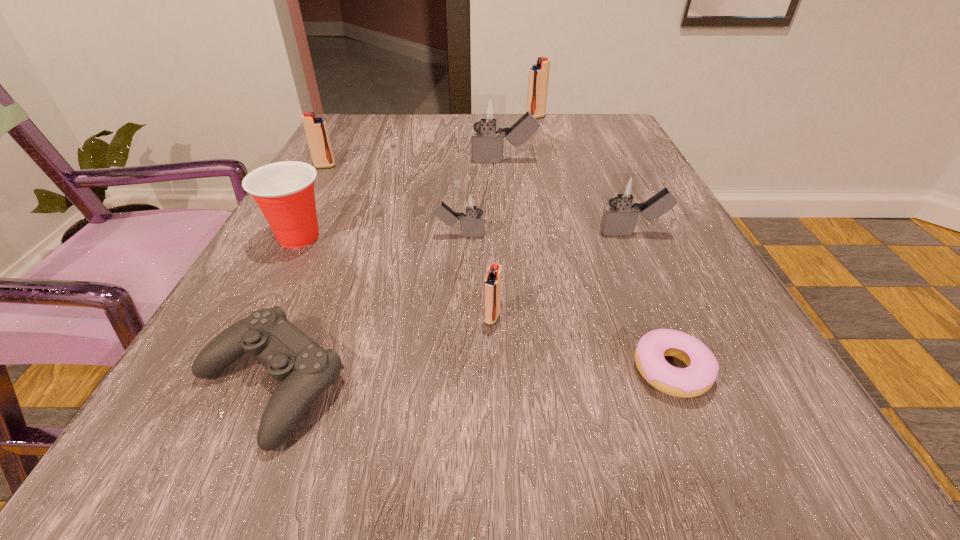
Image resolution: width=960 pixels, height=540 pixels. I want to click on object that is positioned at the near left corner, so click(305, 370).

The height and width of the screenshot is (540, 960). Find the location of `free space at the far edge of the desktop`. free space at the far edge of the desktop is located at coordinates (465, 145).

The image size is (960, 540). In the image, there is a desktop. Identify the location of blank space at the near edge. (335, 435).

At what (x,y) coordinates should I click in order to perform the action: click on vacant space at the left edge of the desktop. Please return your answer as a coordinate pair (x, y). Image resolution: width=960 pixels, height=540 pixels. Looking at the image, I should click on (275, 242).

At what (x,y) coordinates should I click in order to perform the action: click on free space at the right edge of the desktop. Please return your answer as a coordinate pair (x, y). Looking at the image, I should click on (622, 259).

The width and height of the screenshot is (960, 540). I want to click on free space at the far right corner of the desktop, so click(x=572, y=119).

The height and width of the screenshot is (540, 960). What are the coordinates of `vacant space at the near right corner` in the screenshot? It's located at (857, 497).

Identify the location of free space between the rightmost igniter and the shortest object. (652, 302).

Find the location of a particular element. vacant space in between the second red igniter from left to right and the pink doughnut is located at coordinates (582, 344).

I want to click on vacant space in between the farthest object and the eighth tallest object, so click(x=402, y=251).